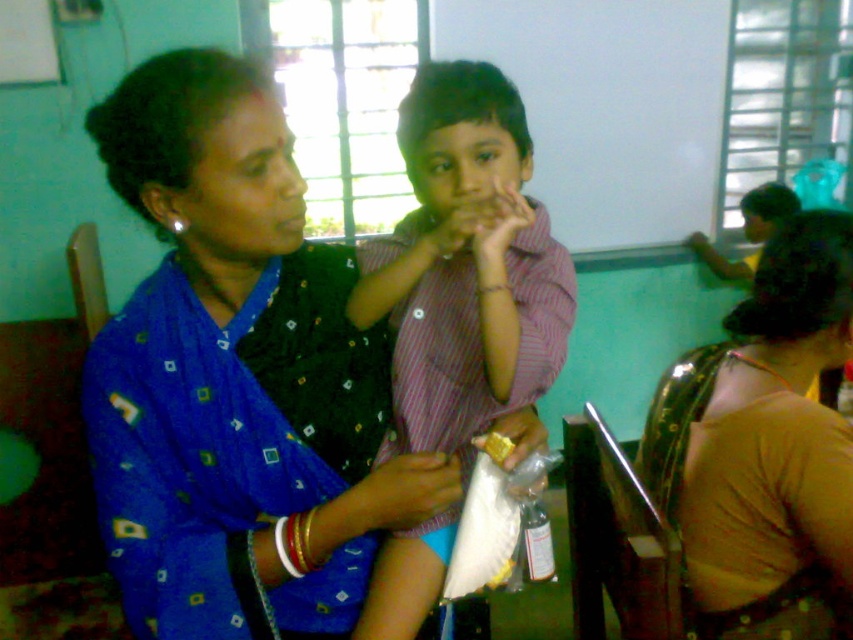
You are a student who needs to reach the yellow matte snack at center during a break. If your hand can extend 20 centimeters, can you grab it while keeping your hand on the striped cotton shirt at center?

The distance between the striped cotton shirt at center and the yellow matte snack at center is 24.66 centimeters. Since your hand can only extend 20 centimeters, you cannot reach the yellow matte snack at center from the striped cotton shirt at center.